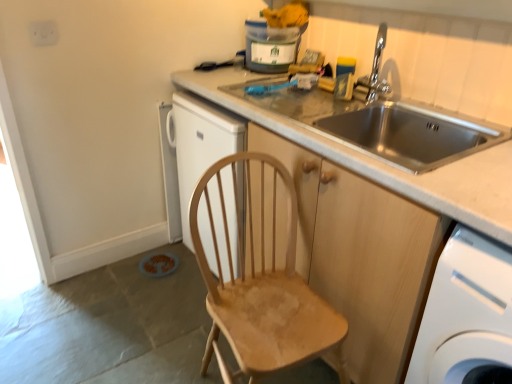
Identify the location of wooden cabinet at center. (361, 256).

The width and height of the screenshot is (512, 384). What do you see at coordinates (361, 256) in the screenshot?
I see `wooden cabinet at center` at bounding box center [361, 256].

At what (x,y) coordinates should I click in order to perform the action: click on natural wood chair at center. Please return your answer as a coordinate pair (x, y). Image resolution: width=512 pixels, height=384 pixels. Looking at the image, I should click on (261, 286).

Between point (405, 75) and point (397, 278), which one is positioned behind?

Point (405, 75)

Considering the sizes of stainless steel sink at upper right and wooden cabinet at center in the image, is stainless steel sink at upper right wider or thinner than wooden cabinet at center?

In the image, stainless steel sink at upper right appears to be more narrow than wooden cabinet at center.

From a real-world perspective, which object rests below the other?

wooden cabinet at center, from a real-world perspective.

Between stainless steel sink at upper right and wooden cabinet at center, which one has less height?

With less height is stainless steel sink at upper right.

Is stainless steel sink at upper right behind white plastic washing machine at lower right?

Yes, the depth of stainless steel sink at upper right is greater than that of white plastic washing machine at lower right.

Is stainless steel sink at upper right shorter than white plastic washing machine at lower right?

Yes, stainless steel sink at upper right is shorter than white plastic washing machine at lower right.

In the scene shown: Does stainless steel sink at upper right touch white plastic washing machine at lower right?

stainless steel sink at upper right and white plastic washing machine at lower right are not in contact.

Is point (283, 102) farther from camera compared to point (459, 285)?

Yes, it is behind point (459, 285).

Who is bigger, chrome metallic faucet at upper right or white plastic washing machine at lower right?

Bigger between the two is white plastic washing machine at lower right.

Is chrome metallic faucet at upper right inside or outside of white plastic washing machine at lower right?

chrome metallic faucet at upper right is outside white plastic washing machine at lower right.

Does point (377, 52) come farther from viewer compared to point (459, 311)?

Yes.

Can you confirm if chrome metallic faucet at upper right is positioned to the left of white plastic washing machine at lower right?

Correct, you'll find chrome metallic faucet at upper right to the left of white plastic washing machine at lower right.

Identify the location of sink behind the natural wood chair at center. The width and height of the screenshot is (512, 384). (385, 124).

Between stainless steel sink at upper right and natural wood chair at center, which one has more height?

With more height is natural wood chair at center.

Is natural wood chair at center at the back of stainless steel sink at upper right?

No, stainless steel sink at upper right is not facing the opposite direction of natural wood chair at center.

Considering the points (498, 330) and (221, 187), which point is in front, point (498, 330) or point (221, 187)?

The point (498, 330) is closer to the camera.

How many degrees apart are the facing directions of white plastic washing machine at lower right and natural wood chair at center?

The facing directions of white plastic washing machine at lower right and natural wood chair at center are 89 degrees apart.

Is natural wood chair at center at the back of white plastic washing machine at lower right?

white plastic washing machine at lower right does not have its back to natural wood chair at center.

In the scene shown: Can you confirm if white plastic washing machine at lower right is smaller than natural wood chair at center?

Correct, white plastic washing machine at lower right occupies less space than natural wood chair at center.

In the image, is chrome metallic faucet at upper right positioned in front of or behind stainless steel sink at upper right?

Clearly, chrome metallic faucet at upper right is behind stainless steel sink at upper right.

Consider the image. Is chrome metallic faucet at upper right turned away from stainless steel sink at upper right?

That's right, chrome metallic faucet at upper right is facing away from stainless steel sink at upper right.

Considering the sizes of objects chrome metallic faucet at upper right and stainless steel sink at upper right in the image provided, who is thinner, chrome metallic faucet at upper right or stainless steel sink at upper right?

stainless steel sink at upper right is thinner.

Between point (374, 58) and point (422, 117), which one is positioned behind?

Point (374, 58)

Looking at the image, does natural wood chair at center seem bigger or smaller compared to wooden cabinet at center?

Considering their sizes, natural wood chair at center takes up less space than wooden cabinet at center.

Does natural wood chair at center appear on the right side of wooden cabinet at center?

Incorrect, natural wood chair at center is not on the right side of wooden cabinet at center.

Is natural wood chair at center wider than wooden cabinet at center?

No, natural wood chair at center is not wider than wooden cabinet at center.

At what (x,y) coordinates should I click in order to perform the action: click on sink lying above the wooden cabinet at center (from the image's perspective). Please return your answer as a coordinate pair (x, y). Image resolution: width=512 pixels, height=384 pixels. Looking at the image, I should click on (385, 124).

Locate an element on the screen. home appliance in front of the stainless steel sink at upper right is located at coordinates (466, 315).

Considering their positions, is wooden cabinet at center positioned further to natural wood chair at center than stainless steel sink at upper right?

Based on the image, stainless steel sink at upper right appears to be further to natural wood chair at center.

Looking at this image, based on their spatial positions, is stainless steel sink at upper right or wooden cabinet at center closer to chrome metallic faucet at upper right?

stainless steel sink at upper right is positioned closer to the anchor chrome metallic faucet at upper right.

When comparing their distances from stainless steel sink at upper right, does white plastic washing machine at lower right or wooden cabinet at center seem further?

The object further to stainless steel sink at upper right is white plastic washing machine at lower right.

Based on their spatial positions, is white plastic washing machine at lower right or wooden cabinet at center further from chrome metallic faucet at upper right?

Among the two, white plastic washing machine at lower right is located further to chrome metallic faucet at upper right.

Estimate the real-world distances between objects in this image. Which object is closer to chrome metallic faucet at upper right, natural wood chair at center or stainless steel sink at upper right?

stainless steel sink at upper right lies closer to chrome metallic faucet at upper right than the other object.

Based on their spatial positions, is wooden cabinet at center or chrome metallic faucet at upper right further from stainless steel sink at upper right?

Among the two, wooden cabinet at center is located further to stainless steel sink at upper right.

Which object lies nearer to the anchor point chrome metallic faucet at upper right, white plastic washing machine at lower right or stainless steel sink at upper right?

stainless steel sink at upper right is closer to chrome metallic faucet at upper right.

Based on their spatial positions, is wooden cabinet at center or chrome metallic faucet at upper right further from natural wood chair at center?

chrome metallic faucet at upper right lies further to natural wood chair at center than the other object.

The width and height of the screenshot is (512, 384). I want to click on chair between stainless steel sink at upper right and white plastic washing machine at lower right vertically, so click(261, 286).

Identify the location of cabinetry situated between natural wood chair at center and white plastic washing machine at lower right from left to right. The width and height of the screenshot is (512, 384). click(x=361, y=256).

Locate an element on the screen. This screenshot has height=384, width=512. tap between stainless steel sink at upper right and white plastic washing machine at lower right in the up-down direction is located at coordinates (375, 70).

Find the location of a particular element. The height and width of the screenshot is (384, 512). chair that lies between chrome metallic faucet at upper right and white plastic washing machine at lower right from top to bottom is located at coordinates (261, 286).